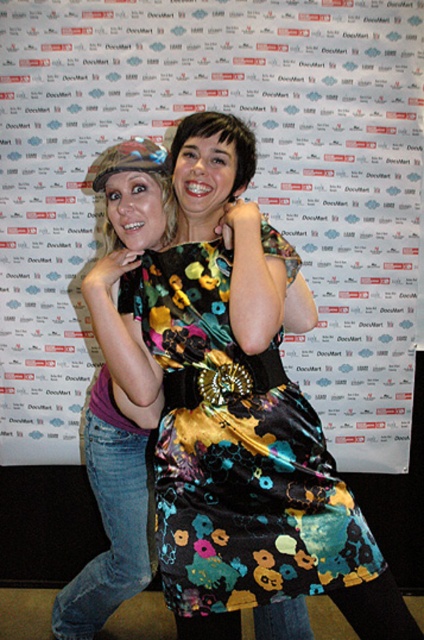
You are standing in front of the promotional backdrop and notice the floral fabric dress at center. Can you determine its exact position using the coordinate system provided?

The floral fabric dress at center is located at point (247, 193) in the coordinate system provided.

You are standing in front of the promotional backdrop and see two points marked in the image. Which point is closer to you, point (382, 225) or point (183, 124)?

Point (183, 124) is closer to you because point (382, 225) is behind it.